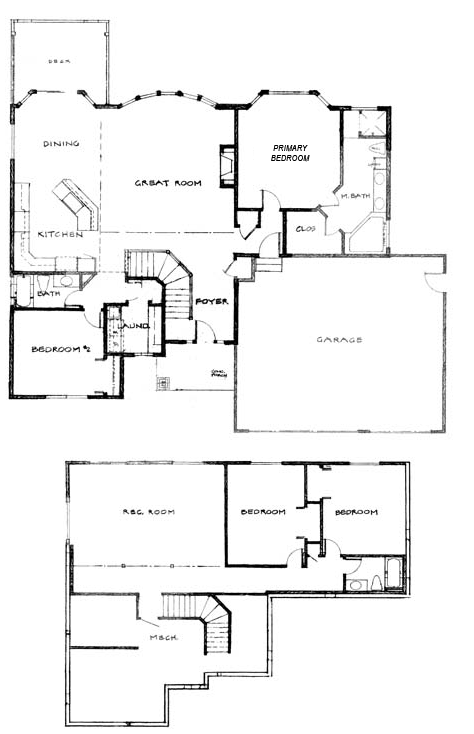
Show me where red. room are located in the image. Your answer should be formatted as a list of tuples, i.e. [(x1, y1), (x2, y2), ...], where each tuple contains the x and y coordinates of a point satisfying the conditions above.

[(142, 515)]